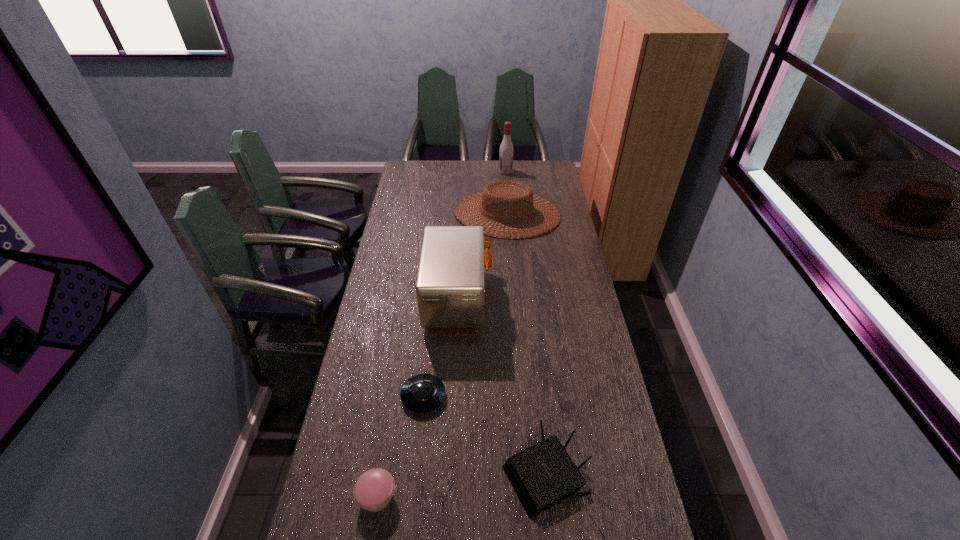
Find the location of a particular element. free space located on the label of the tallest object is located at coordinates (451, 172).

Where is `free space located on the label of the tallest object`? free space located on the label of the tallest object is located at coordinates (453, 172).

What are the coordinates of `free spot located on the label of the tallest object` in the screenshot? It's located at (456, 172).

I want to click on vacant area situated 0.100m on the door side of the second tallest object, so click(516, 296).

At what (x,y) coordinates should I click in order to perform the action: click on free point located on the front of the sunhat. Please return your answer as a coordinate pair (x, y). Looking at the image, I should click on (512, 278).

Find the location of a particular element. This screenshot has height=540, width=960. free space located on the back of the router is located at coordinates (537, 403).

This screenshot has width=960, height=540. I want to click on vacant space located on the right of the fifth tallest object, so click(543, 497).

I want to click on vacant space situated 0.320m on the back of the shortest object, so click(x=433, y=308).

Locate an element on the screen. Image resolution: width=960 pixels, height=540 pixels. object at the far edge is located at coordinates (506, 150).

This screenshot has width=960, height=540. What are the coordinates of `object that is at the left edge` in the screenshot? It's located at (373, 490).